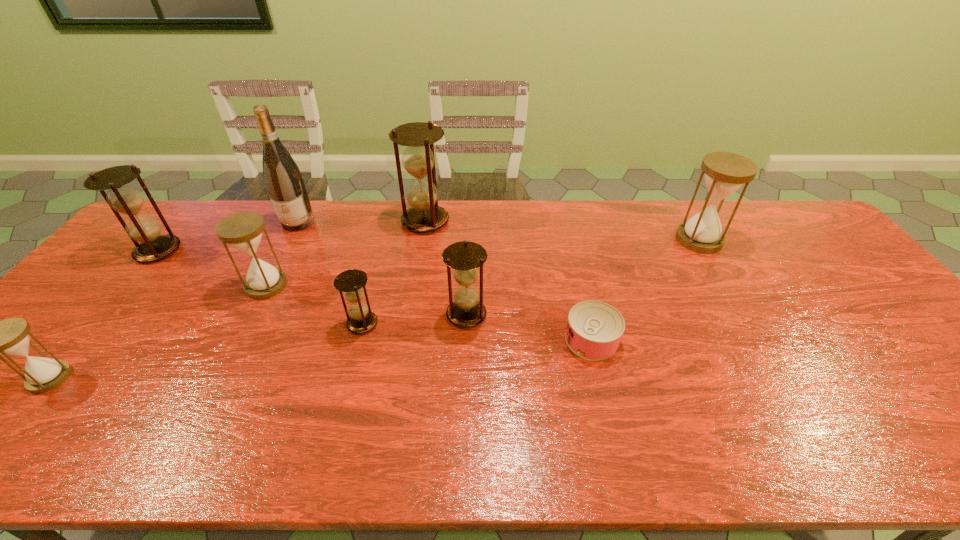
The image size is (960, 540). I want to click on vacant point that satisfies the following two spatial constraints: 1. on the back side of the second farthest brown hourglass; 2. on the left side of the biggest brown hourglass, so tap(182, 221).

The height and width of the screenshot is (540, 960). I want to click on free space that satisfies the following two spatial constraints: 1. on the label of the brown wine bottle; 2. on the right side of the biggest white hourglass, so click(289, 240).